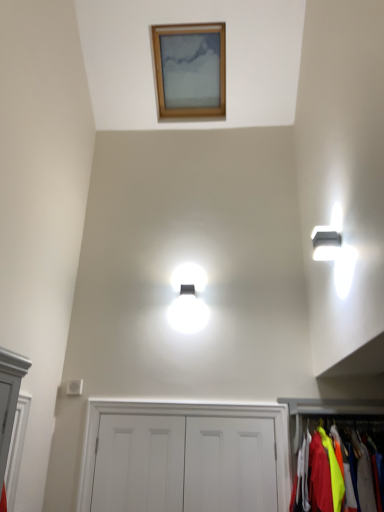
Question: Does white matte door at center, which ranks as the first door in right-to-left order, have a smaller size compared to neon yellow fabric at lower right, positioned as the second dresser in left-to-right order?

Choices:
 (A) no
 (B) yes

Answer: (B)

Question: Does white matte door at center, positioned as the second door in left-to-right order, come behind neon yellow fabric at lower right, positioned as the second dresser in left-to-right order?

Choices:
 (A) yes
 (B) no

Answer: (A)

Question: Could neon yellow fabric at lower right, the first dresser from the right, be considered to be inside white matte door at center, which ranks as the first door in right-to-left order?

Choices:
 (A) yes
 (B) no

Answer: (B)

Question: Is white matte door at center, positioned as the second door in left-to-right order, shorter than neon yellow fabric at lower right, positioned as the second dresser in left-to-right order?

Choices:
 (A) no
 (B) yes

Answer: (A)

Question: Does white matte door at center, which ranks as the first door in right-to-left order, have a larger size compared to neon yellow fabric at lower right, positioned as the second dresser in left-to-right order?

Choices:
 (A) yes
 (B) no

Answer: (B)

Question: Relative to wooden picture frame at upper center, is neon yellow fabric at lower right, positioned as the second dresser in left-to-right order, in front or behind?

Choices:
 (A) front
 (B) behind

Answer: (A)

Question: From their relative heights in the image, would you say neon yellow fabric at lower right, the first dresser from the right, is taller or shorter than wooden picture frame at upper center?

Choices:
 (A) tall
 (B) short

Answer: (B)

Question: From a real-world perspective, is neon yellow fabric at lower right, the first dresser from the right, above or below wooden picture frame at upper center?

Choices:
 (A) above
 (B) below

Answer: (B)

Question: Looking at the image, does neon yellow fabric at lower right, positioned as the second dresser in left-to-right order, seem bigger or smaller compared to wooden picture frame at upper center?

Choices:
 (A) small
 (B) big

Answer: (A)

Question: Does point (278, 442) appear closer or farther from the camera than point (327, 401)?

Choices:
 (A) closer
 (B) farther

Answer: (A)

Question: Looking at their shapes, would you say white matte door at center, positioned as the first dresser in left-to-right order, is wider or thinner than neon yellow fabric at lower right, the first dresser from the right?

Choices:
 (A) wide
 (B) thin

Answer: (B)

Question: Is white matte door at center, marked as the second dresser in a right-to-left arrangement, taller or shorter than neon yellow fabric at lower right, the first dresser from the right?

Choices:
 (A) tall
 (B) short

Answer: (A)

Question: Considering their positions, is white matte door at center, marked as the second dresser in a right-to-left arrangement, located in front of or behind neon yellow fabric at lower right, the first dresser from the right?

Choices:
 (A) behind
 (B) front

Answer: (A)

Question: From the image's perspective, relative to neon yellow fabric at lower right, the first dresser from the right, is white matte door at center, which appears as the 2th door when viewed from the right, above or below?

Choices:
 (A) below
 (B) above

Answer: (A)

Question: Is white matte door at center, which appears as the 2th door when viewed from the right, taller or shorter than neon yellow fabric at lower right, positioned as the second dresser in left-to-right order?

Choices:
 (A) short
 (B) tall

Answer: (B)